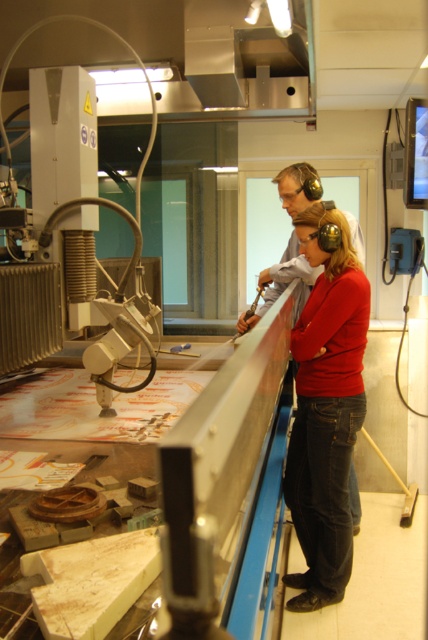
Who is positioned more to the left, matte red sweater at center or matte black headphones at upper center?

From the viewer's perspective, matte red sweater at center appears more on the left side.

Does point (344, 544) come farther from viewer compared to point (302, 259)?

No, it is in front of (302, 259).

Locate an element on the screen. matte red sweater at center is located at coordinates (326, 406).

This screenshot has width=428, height=640. Identify the location of matte red sweater at center. (326, 406).